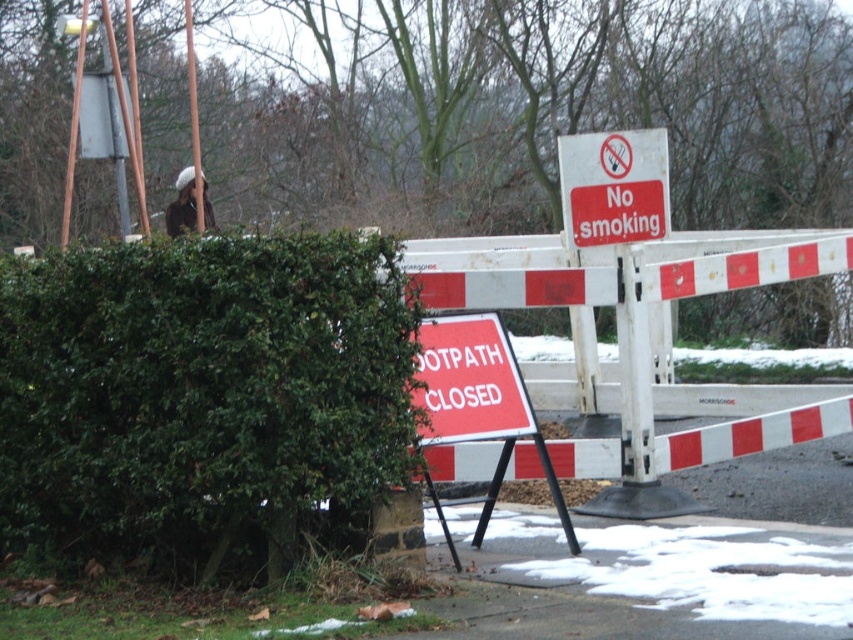
Between green leafy hedge at left and brushed metal pole at upper center, which one appears on the right side from the viewer's perspective?

green leafy hedge at left is more to the right.

Is green leafy hedge at left further to the viewer compared to brushed metal pole at upper center?

No.

Is point (395, 460) closer to camera compared to point (201, 221)?

That is True.

Locate an element on the screen. Image resolution: width=853 pixels, height=640 pixels. green leafy hedge at left is located at coordinates (201, 396).

What do you see at coordinates (613, 186) in the screenshot?
I see `red plastic sign at upper center` at bounding box center [613, 186].

Image resolution: width=853 pixels, height=640 pixels. In order to click on red plastic sign at upper center in this screenshot , I will do `click(613, 186)`.

Where is `red plastic sign at upper center`? red plastic sign at upper center is located at coordinates 613,186.

Is red plastic sign at center above brushed metal pole at upper center?

Actually, red plastic sign at center is below brushed metal pole at upper center.

Is point (444, 387) farther from camera compared to point (195, 154)?

No, it is in front of (195, 154).

Identify the location of red plastic sign at center. (469, 381).

At what (x,y) coordinates should I click in order to perform the action: click on red plastic sign at center. Please return your answer as a coordinate pair (x, y). This screenshot has width=853, height=640. Looking at the image, I should click on (469, 381).